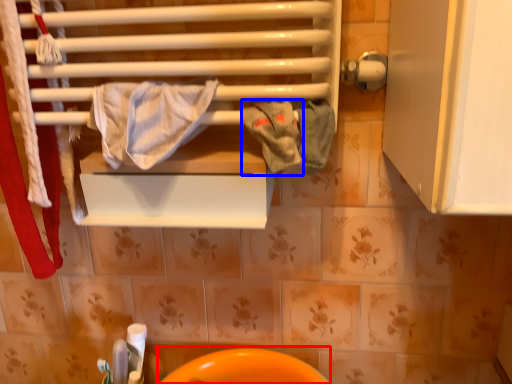
Question: Which object appears farthest to the camera in this image, sink (highlighted by a red box) or bath towel (highlighted by a blue box)?

Choices:
 (A) sink
 (B) bath towel

Answer: (A)